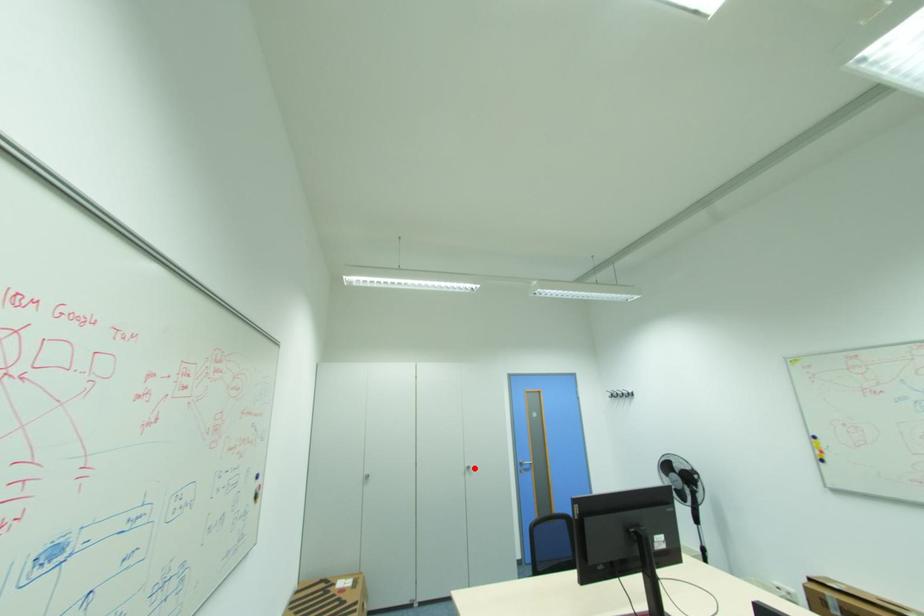
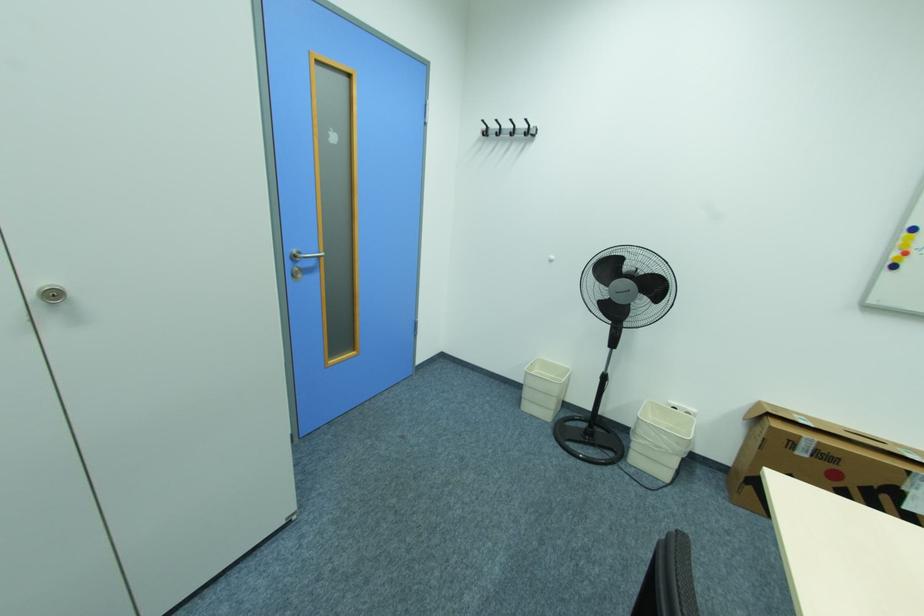
Find the pixel in the second image that matches the highlighted location in the first image.

(64, 294)